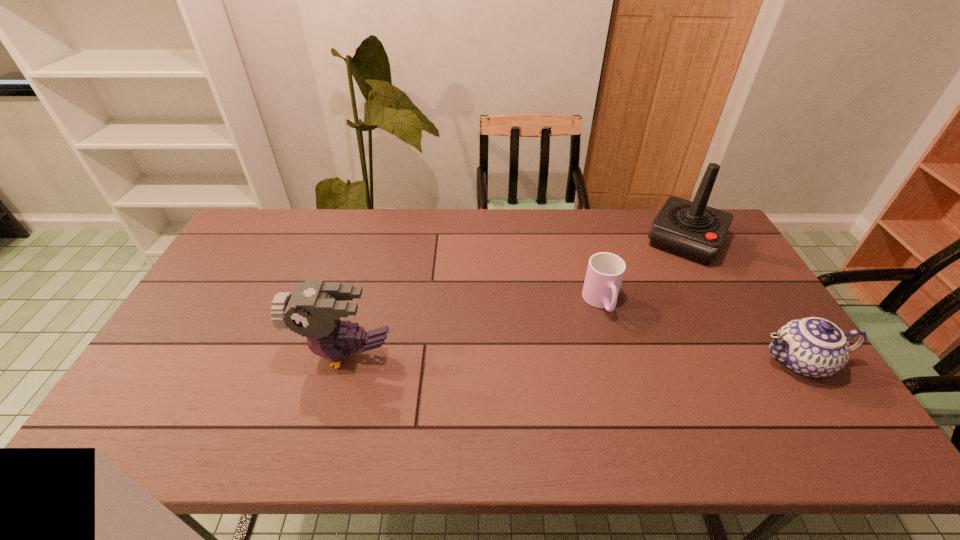
The height and width of the screenshot is (540, 960). I want to click on free space on the desktop that is between the leftmost object and the chinaware and is positioned with the handle on the side of the second object from left to right, so click(x=624, y=359).

Find the location of `free spot on the desktop that is between the leftmost object and the chinaware and is positioned on the front-facing side of the tallest object`. free spot on the desktop that is between the leftmost object and the chinaware and is positioned on the front-facing side of the tallest object is located at coordinates (621, 359).